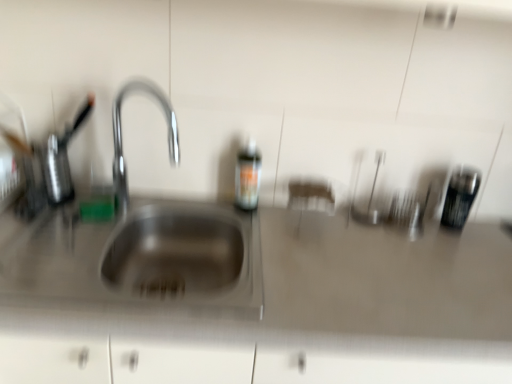
At what (x,y) coordinates should I click in order to perform the action: click on free space in front of metallic black canister at right. Please return your answer as a coordinate pair (x, y). The height and width of the screenshot is (384, 512). Looking at the image, I should click on (466, 254).